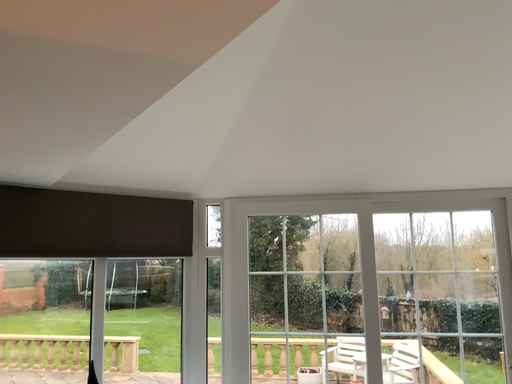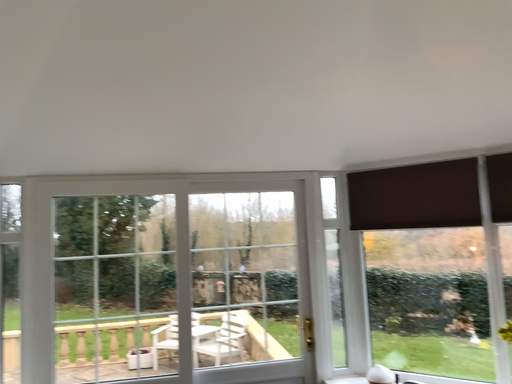
Question: Which way did the camera rotate in the video?

Choices:
 (A) rotated left
 (B) rotated right

Answer: (B)